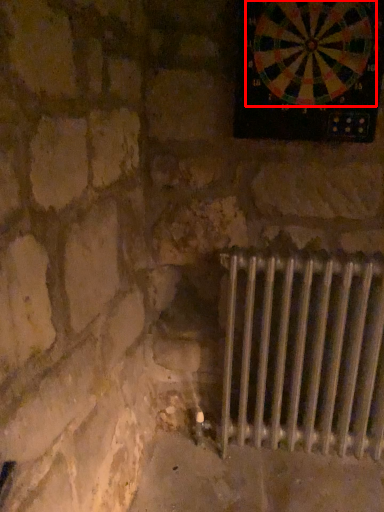
Question: In this image, where is wheel (annotated by the red box) located relative to radiator?

Choices:
 (A) right
 (B) left

Answer: (B)